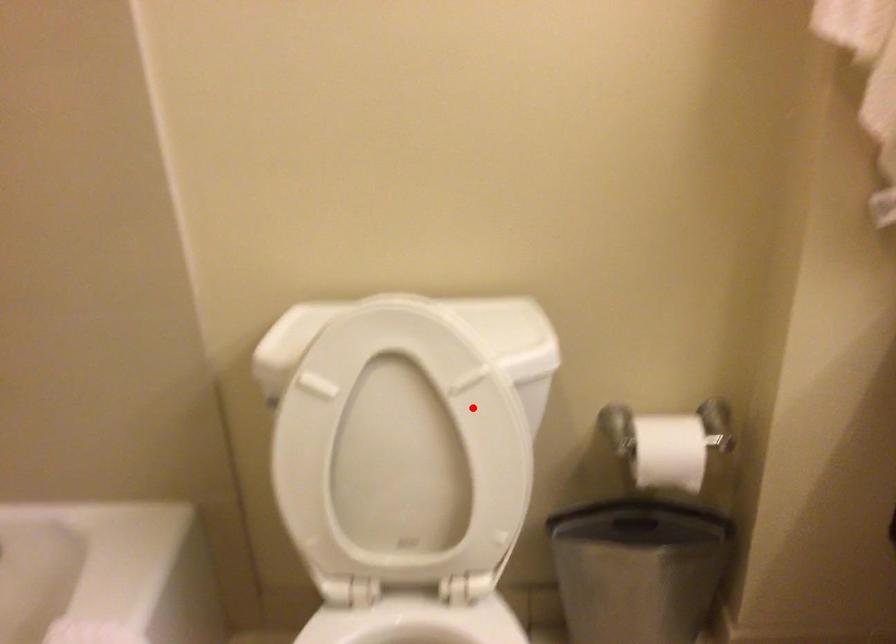
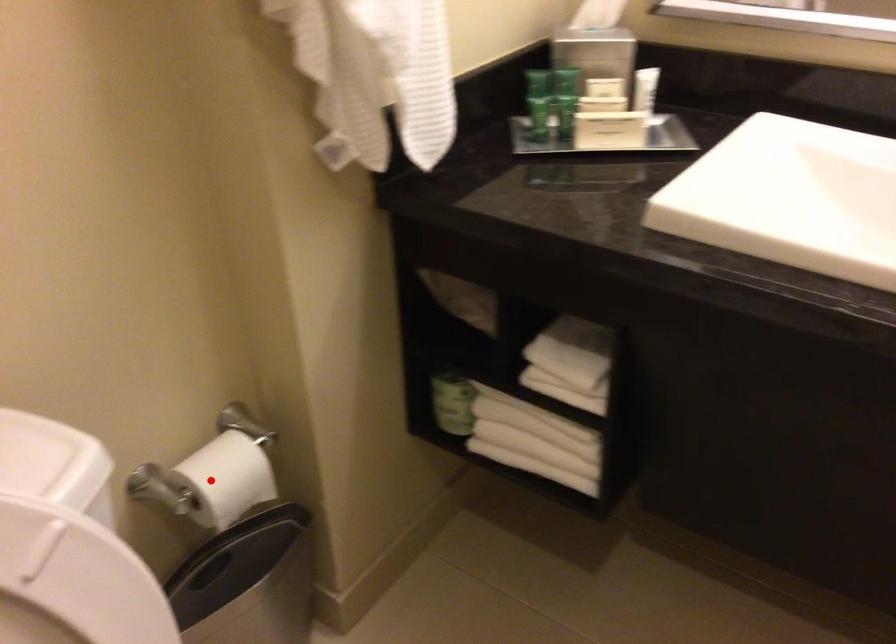
I am providing you with two images of the same scene from different viewpoints. A red point is marked on the first image and another point is marked on the second image. Does the point marked in image1 correspond to the same location as the one in image2?

No